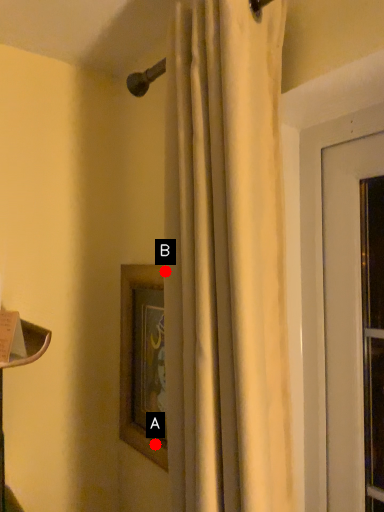
Question: Two points are circled on the image, labeled by A and B beside each circle. Which point is further to the camera?

Choices:
 (A) A is further
 (B) B is further

Answer: (A)